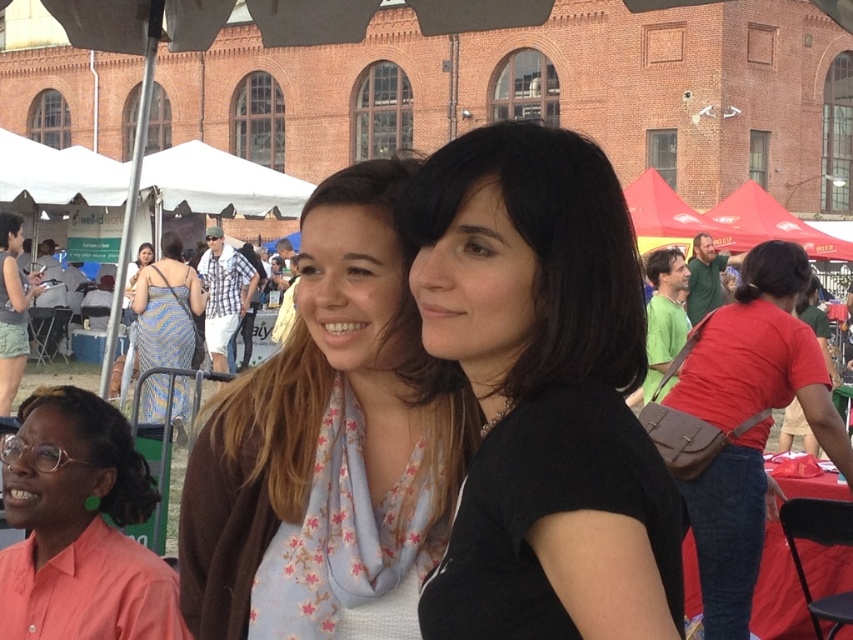
Does black matte shirt at center have a greater height compared to matte black laptop at left?

Correct, black matte shirt at center is much taller as matte black laptop at left.

Who is higher up, black matte shirt at center or matte black laptop at left?

matte black laptop at left is higher up.

Identify the location of black matte shirt at center. (543, 392).

Who is shorter, light brown scarf at center or pink fabric shirt at lower left?

pink fabric shirt at lower left

Between point (413, 531) and point (24, 566), which one is positioned behind?

The point (24, 566) is more distant.

Which is in front, point (318, 515) or point (79, 550)?

Point (318, 515)

At what (x,y) coordinates should I click in order to perform the action: click on light brown scarf at center. Please return your answer as a coordinate pair (x, y). The image size is (853, 640). Looking at the image, I should click on (328, 436).

Can you confirm if brown leather bag at right is smaller than metallic blue dress at center-left?

Yes.

Which is in front, point (744, 336) or point (138, 310)?

Point (744, 336) is more forward.

This screenshot has height=640, width=853. In order to click on brown leather bag at right in this screenshot , I will do `click(762, 355)`.

At what (x,y) coordinates should I click in order to perform the action: click on brown leather bag at right. Please return your answer as a coordinate pair (x, y). Looking at the image, I should click on (762, 355).